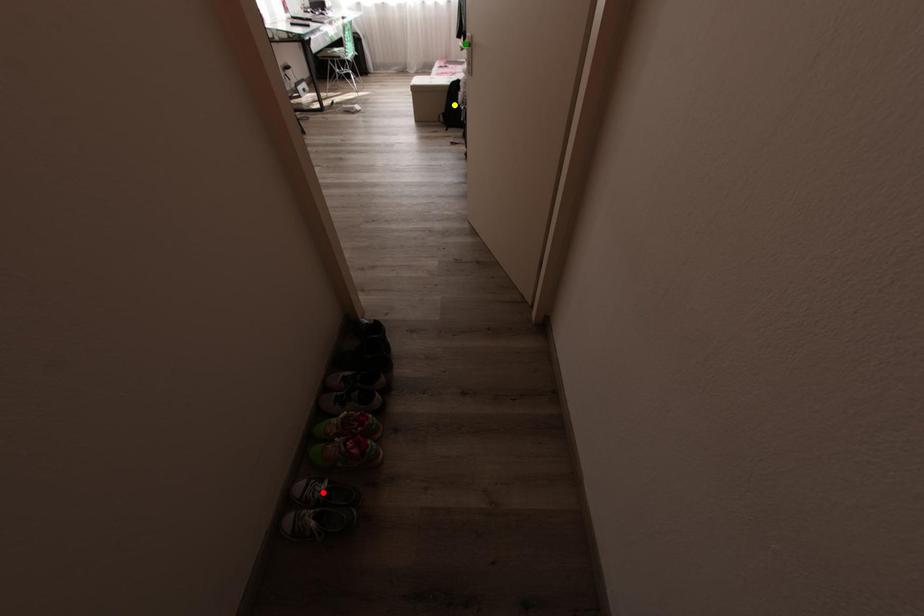
Order these from nearest to farthest:
yellow point | red point | green point

red point → yellow point → green point